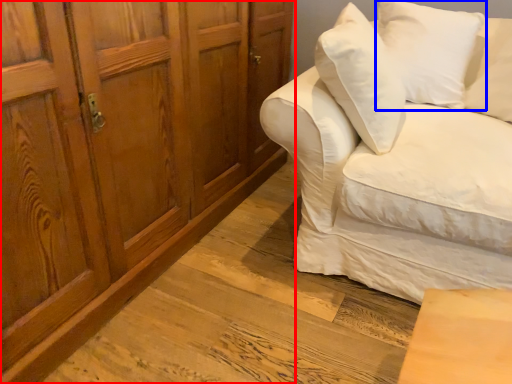
Question: Which object is further to the camera taking this photo, cabinetry (highlighted by a red box) or pillow (highlighted by a blue box)?

Choices:
 (A) cabinetry
 (B) pillow

Answer: (B)